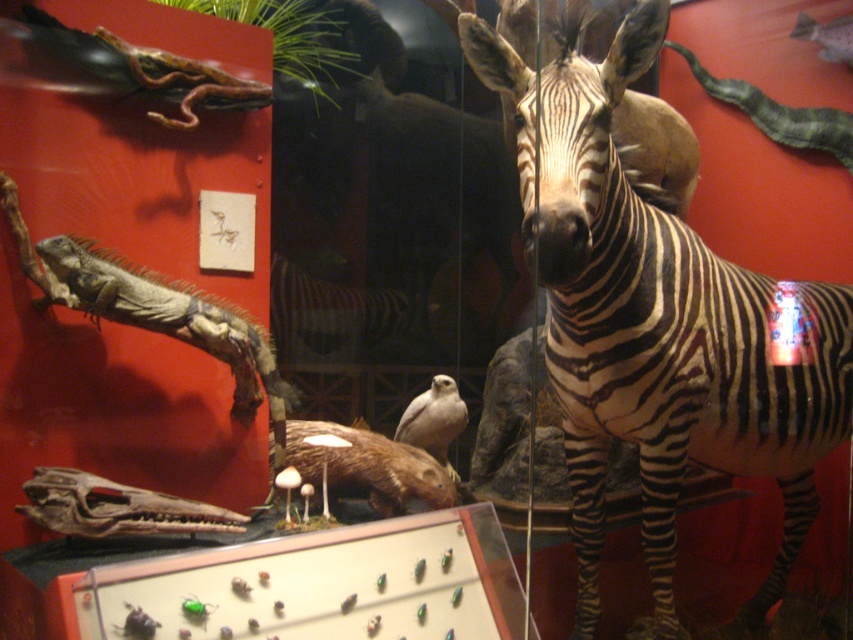
Who is higher up, green scaly lizard at left or white feathered bird at center?

Positioned higher is green scaly lizard at left.

Which is in front, point (144, 282) or point (425, 400)?

Point (144, 282)

In the scene shown: Who is more forward, (128, 276) or (450, 465)?

Positioned in front is point (128, 276).

Where is `green scaly lizard at left`? Image resolution: width=853 pixels, height=640 pixels. green scaly lizard at left is located at coordinates 169,316.

Who is positioned more to the left, black and white striped zebra at center or white feathered bird at center?

white feathered bird at center

How distant is black and white striped zebra at center from white feathered bird at center?

They are 1.01 meters apart.

This screenshot has width=853, height=640. I want to click on black and white striped zebra at center, so click(x=656, y=324).

Find the location of `black and white striped zebra at center`. black and white striped zebra at center is located at coordinates (656, 324).

Based on the photo, which of these two, black and white striped zebra at center or green scaly lizard at left, stands taller?

black and white striped zebra at center

Does black and white striped zebra at center appear on the right side of green scaly lizard at left?

Correct, you'll find black and white striped zebra at center to the right of green scaly lizard at left.

What are the coordinates of `black and white striped zebra at center` in the screenshot? It's located at (656, 324).